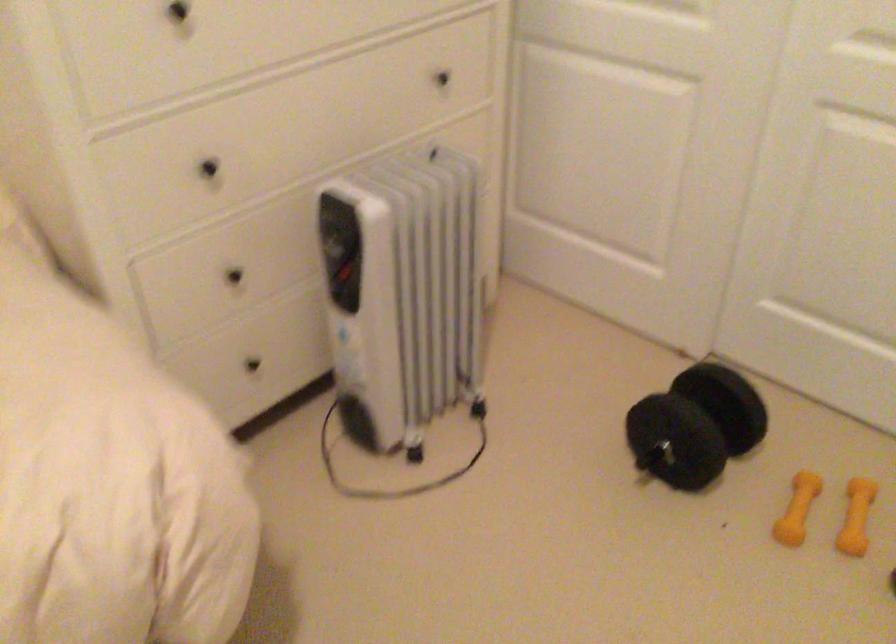
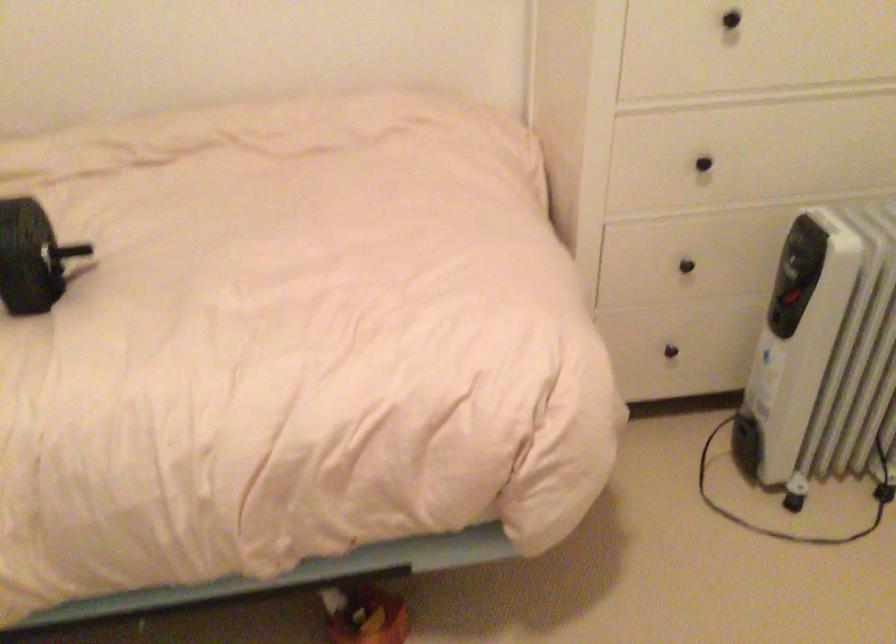
Where in the second image is the point corresponding to point 208,167 from the first image?

(702, 164)